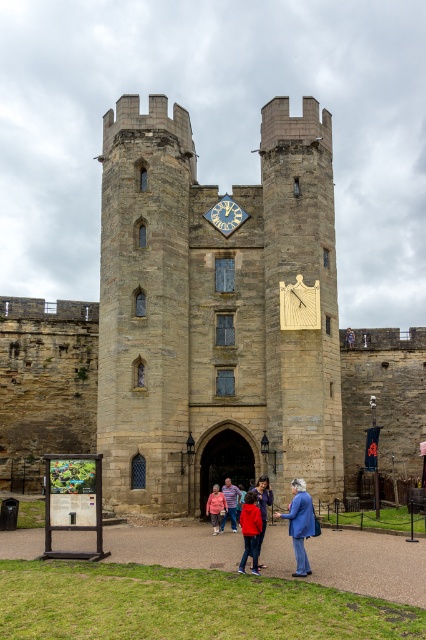
You are a visitor approaching the brown stone castle at center and notice the goldmetallicclock at center. Which object is located higher up in the image?

The goldmetallicclock at center is positioned higher up than the brown stone castle at center.